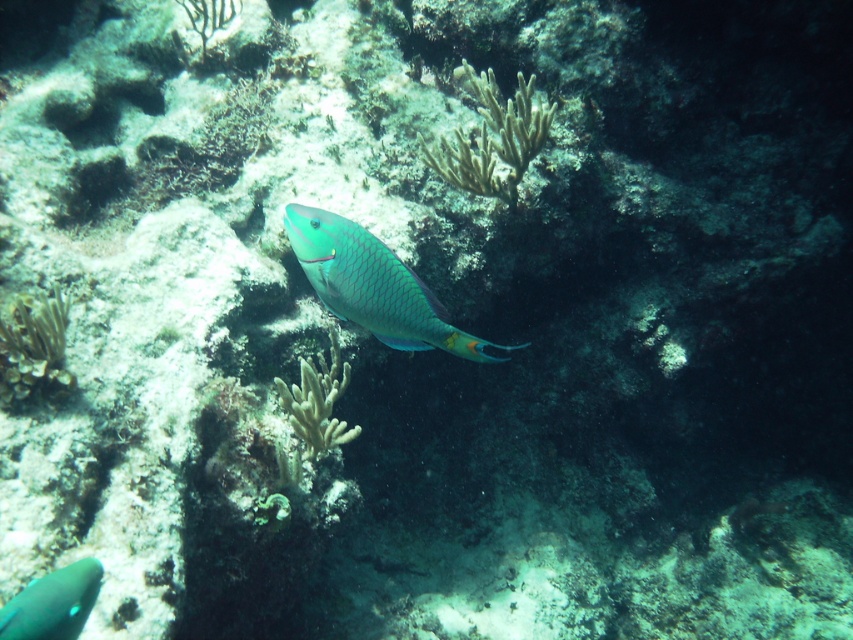
You are a marine biologist observing an underwater scene. You see the teal glossy fish at center. Based on its position, can you determine if it is closer to the top or bottom of the image?

The 2D location of the teal glossy fish at center is at point (374, 285). Since the y coordinate is 0.440, which is closer to 0.5, the fish is near the center vertically. Therefore, it is neither closer to the top nor the bottom of the image.

You are a marine biologist observing the underwater scene. You notice the teal glossy fish at center and the white coral at center. Which object is taller?

The white coral at center is taller than the teal glossy fish at center.